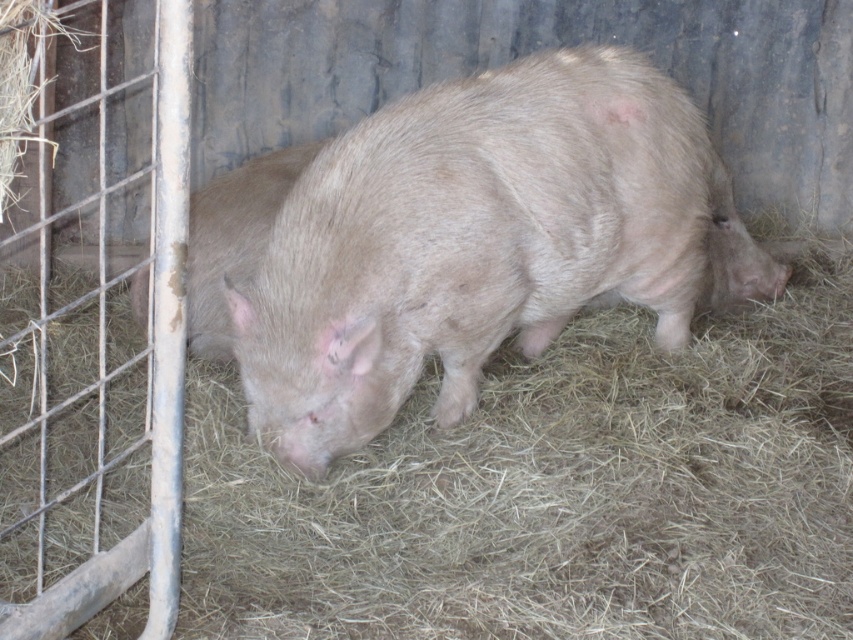
Question: Which point is closer to the camera?

Choices:
 (A) (730, 276)
 (B) (222, 220)

Answer: (B)

Question: Which point is closer to the camera?

Choices:
 (A) (279, 160)
 (B) (344, 420)

Answer: (B)

Question: Does fuzzy brown pig at center appear on the left side of fuzzy pink pig at center?

Choices:
 (A) no
 (B) yes

Answer: (A)

Question: Is fuzzy brown pig at center wider than fuzzy pink pig at center?

Choices:
 (A) no
 (B) yes

Answer: (B)

Question: Which object appears closest to the camera in this image?

Choices:
 (A) fuzzy brown pig at center
 (B) fuzzy pink pig at center

Answer: (A)

Question: Can you confirm if fuzzy brown pig at center is thinner than fuzzy pink pig at center?

Choices:
 (A) no
 (B) yes

Answer: (A)